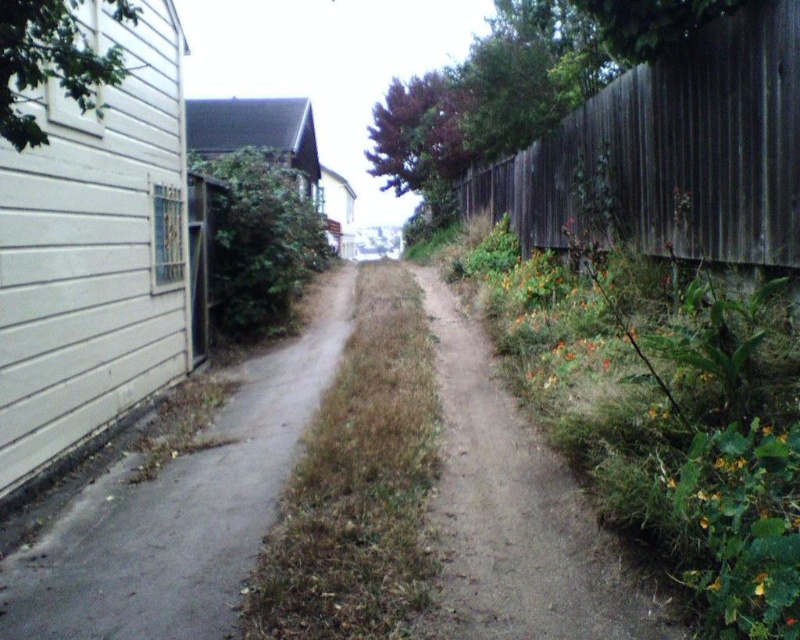
You are a delivery drone trying to navigate through an alleyway. The dark brown wood fence at right is in your path. Based on its position, can you estimate whether the fence is closer to the top or bottom of the alleyway?

The dark brown wood fence at right is located at point coordinates of 0.236 on the x and 0.844 on the y axis. Since the y coordinate is closer to 1, the fence is positioned closer to the bottom of the alleyway.

You are navigating through the alleyway and need to determine the distance between two specific points for a delivery route. The points are labeled as point (304, 372) and point (664, 611). Based on the scene, which point is closer to you as you stand at the entrance of the alleyway?

Point (304, 372) is closer to you since it is further to the viewer than point (664, 611), meaning it is nearer in the alleyway.

You are standing in the middle of the alleyway and want to reach the dark brown wood fence at right. What direction should you move to get there?

You should move to the right since the dark brown wood fence at right is located on the right side of the alleyway.